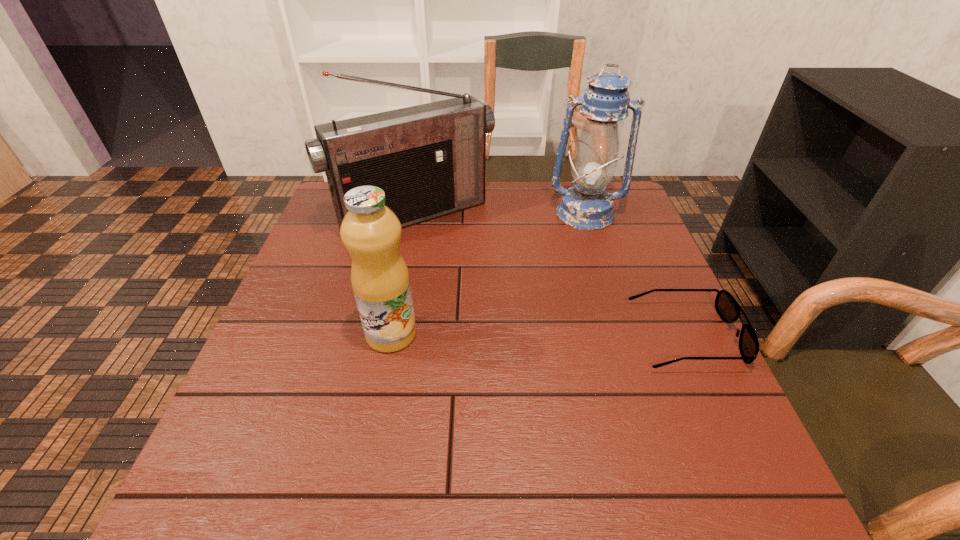
This screenshot has height=540, width=960. Identify the location of free space on the desktop that is between the fruit juice and the shortest object and is positioned on the front-facing side of the radio receiver. (509, 335).

Locate an element on the screen. free spot on the desktop that is between the fruit juice and the spectacles and is positioned on the front-facing side of the lantern is located at coordinates pyautogui.click(x=582, y=335).